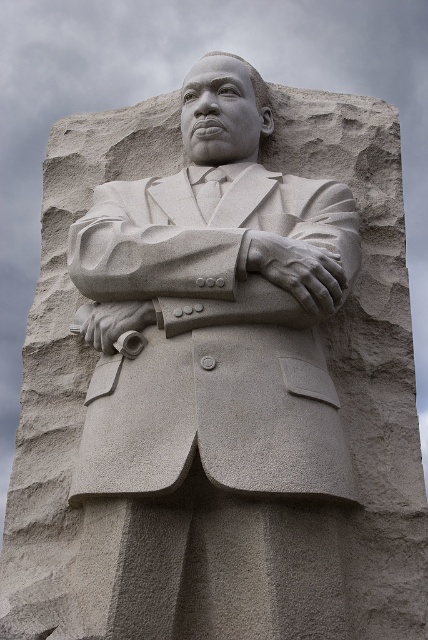
Question: Does gray stone statue at center have a larger size compared to sanded stone arm at center?

Choices:
 (A) yes
 (B) no

Answer: (A)

Question: Which of the following is the closest to the observer?

Choices:
 (A) (258, 204)
 (B) (306, 321)

Answer: (B)

Question: Does gray stone statue at center appear on the right side of sanded stone arm at center?

Choices:
 (A) yes
 (B) no

Answer: (B)

Question: Among these objects, which one is nearest to the camera?

Choices:
 (A) sanded stone arm at center
 (B) gray stone statue at center

Answer: (B)

Question: Can you confirm if gray stone statue at center is positioned below sanded stone arm at center?

Choices:
 (A) yes
 (B) no

Answer: (A)